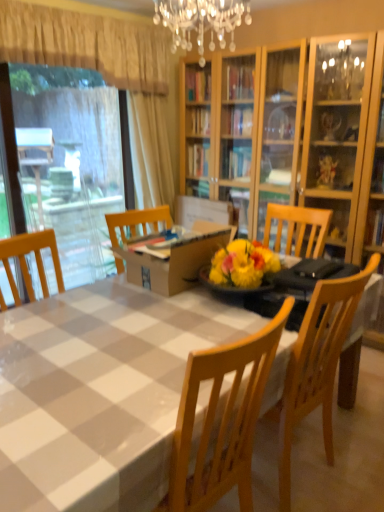
At what (x,y) coordinates should I click in order to perform the action: click on vacant area that lies in front of brown cardboard box at center. Please return your answer as a coordinate pair (x, y). This screenshot has width=384, height=512. Looking at the image, I should click on (148, 325).